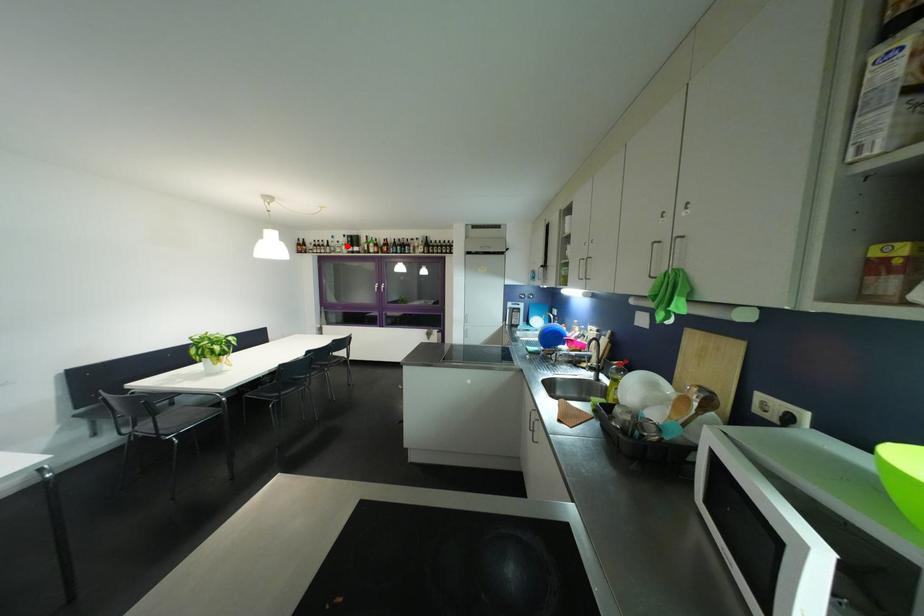
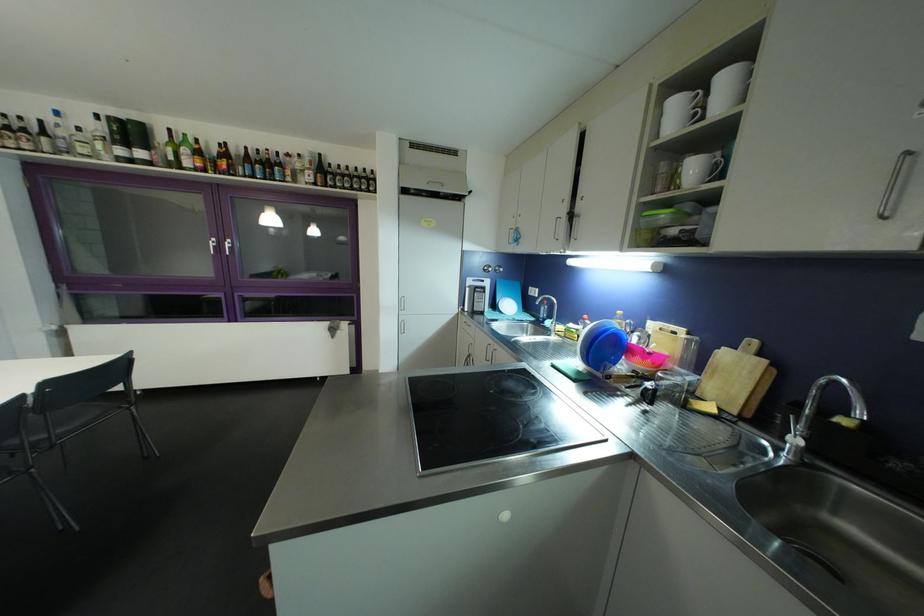
Question: I am providing you with two images of the same scene from different viewpoints. A red point is shown in image1. For the corresponding object point in image2, is it positioned nearer or farther from the camera?

Choices:
 (A) Nearer
 (B) Farther

Answer: (B)